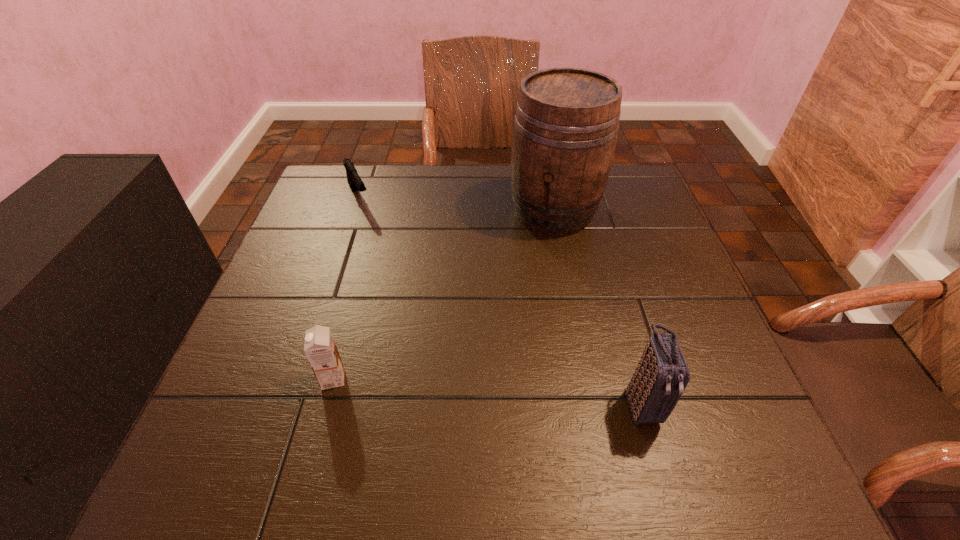
Locate an element on the screen. vacant region that satisfies the following two spatial constraints: 1. on the front side of the shortest object; 2. on the right side of the third tallest object is located at coordinates (298, 379).

Locate an element on the screen. This screenshot has height=540, width=960. free location that satisfies the following two spatial constraints: 1. on the front side of the shortest object; 2. on the left side of the chocolate milk is located at coordinates pyautogui.click(x=298, y=379).

Find the location of a particular element. The width and height of the screenshot is (960, 540). free location that satisfies the following two spatial constraints: 1. on the back side of the cider; 2. on the right side of the chocolate milk is located at coordinates (378, 210).